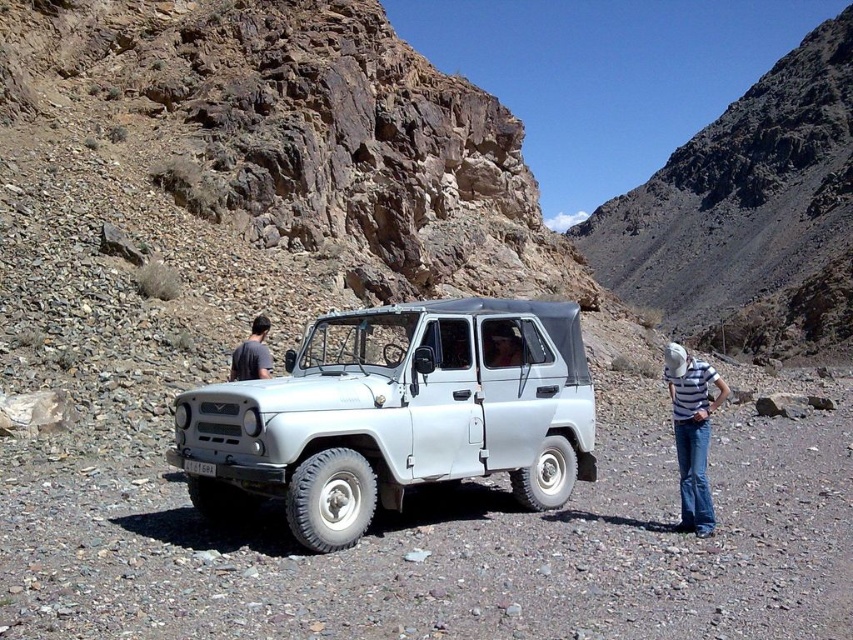
Which of these two, rugged stone hillside at upper right or striped fabric shirt at lower right, stands taller?

With more height is rugged stone hillside at upper right.

Does point (790, 259) lie behind point (694, 384)?

Yes, it is.

This screenshot has height=640, width=853. I want to click on rugged stone hillside at upper right, so click(747, 214).

The image size is (853, 640). What do you see at coordinates (692, 433) in the screenshot?
I see `striped fabric shirt at lower right` at bounding box center [692, 433].

Between point (701, 374) and point (270, 364), which one is positioned in front?

Positioned in front is point (701, 374).

Locate an element on the screen. The image size is (853, 640). striped fabric shirt at lower right is located at coordinates (692, 433).

Which is below, rugged stone hillside at upper right or matte gray vehicle at center?

Positioned lower is matte gray vehicle at center.

Measure the distance between rugged stone hillside at upper right and camera.

rugged stone hillside at upper right is 400.41 feet away from camera.

Does point (692, 205) lie behind point (508, 340)?

Yes.

I want to click on rugged stone hillside at upper right, so click(747, 214).